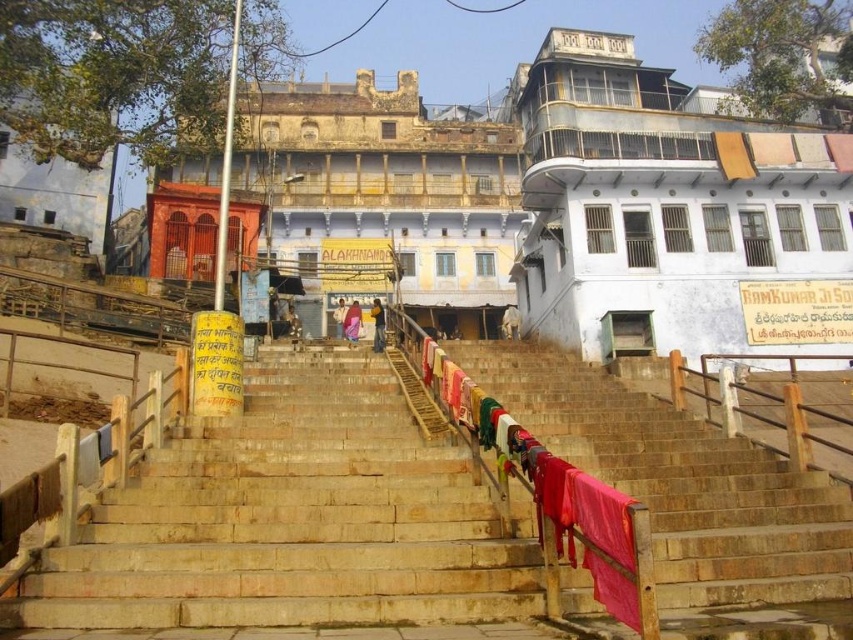
Question: Which object is closer to the camera taking this photo?

Choices:
 (A) white painted building at upper right
 (B) purple fabric at center
 (C) yellow fabric at center

Answer: (A)

Question: From the image, what is the correct spatial relationship of white plaster temple at center in relation to white cotton cloth at center?

Choices:
 (A) left
 (B) right

Answer: (B)

Question: Can you confirm if purple fabric at center is wider than yellow fabric at center?

Choices:
 (A) no
 (B) yes

Answer: (B)

Question: Considering the real-world distances, which object is farthest from the white fabric at center?

Choices:
 (A) white painted building at upper right
 (B) yellow fabric at center
 (C) white cotton cloth at center
 (D) purple fabric at center

Answer: (A)

Question: Is purple fabric at center above white cotton cloth at center?

Choices:
 (A) no
 (B) yes

Answer: (A)

Question: Which point is farther to the camera?

Choices:
 (A) (544, 192)
 (B) (462, 173)

Answer: (B)